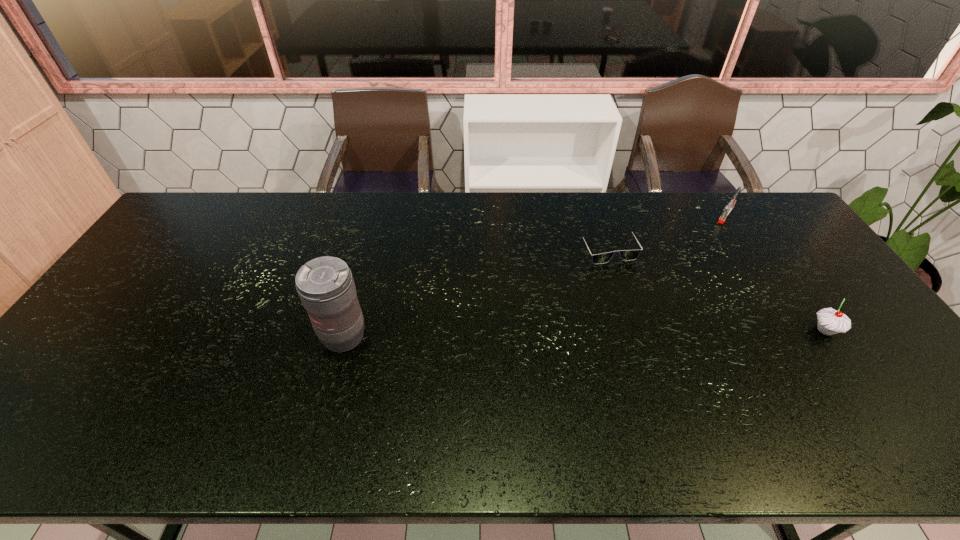
At what (x,y) coordinates should I click in order to perform the action: click on vacant space located 0.110m on the handle side of the third tallest object. Please return your answer as a coordinate pair (x, y). Looking at the image, I should click on (711, 238).

You are a GUI agent. You are given a task and a screenshot of the screen. Output one action in this format:
    pyautogui.click(x=<x>, y=<y>)
    Task: Click on the vacant area located 0.220m on the handle side of the third tallest object
    Image resolution: width=960 pixels, height=540 pixels.
    Given the screenshot: What is the action you would take?
    pyautogui.click(x=699, y=255)

At what (x,y) coordinates should I click in order to perform the action: click on vacant region located on the front-facing side of the second farthest object. Please return your answer as a coordinate pair (x, y). The width and height of the screenshot is (960, 540). Looking at the image, I should click on (673, 368).

Identify the location of vacant space located 0.240m on the front-facing side of the second farthest object. (650, 325).

You are a GUI agent. You are given a task and a screenshot of the screen. Output one action in this format:
    pyautogui.click(x=<x>, y=<y>)
    Task: Click on the free location located 0.090m on the front-facing side of the second farthest object
    The height and width of the screenshot is (540, 960).
    Given the screenshot: What is the action you would take?
    pyautogui.click(x=628, y=285)

Where is `stapler located at the far edge`? This screenshot has width=960, height=540. stapler located at the far edge is located at coordinates (729, 207).

Locate an element on the screen. sunglasses located at the far edge is located at coordinates (626, 255).

At what (x,y) coordinates should I click in order to perform the action: click on cupcake present at the right edge. Please return your answer as a coordinate pair (x, y). Looking at the image, I should click on 830,321.

This screenshot has height=540, width=960. I want to click on stapler at the right edge, so click(729, 207).

Locate an element on the screen. object that is at the far right corner is located at coordinates (729, 207).